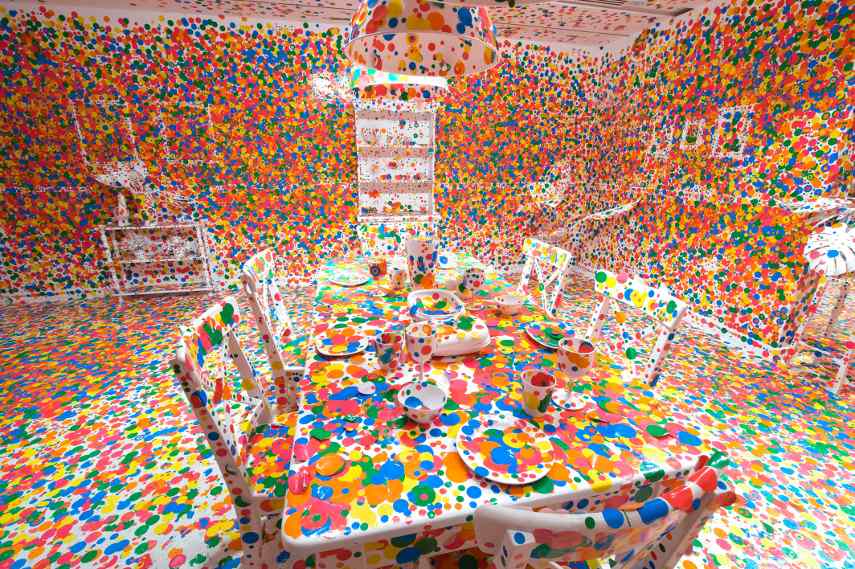
At what (x,y) coordinates should I click in order to perform the action: click on shelf. Please return your answer as a coordinate pair (x, y). The width and height of the screenshot is (855, 569). Looking at the image, I should click on (422, 176).